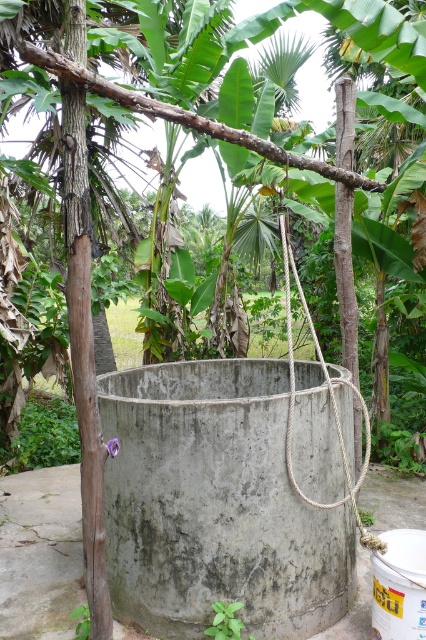
Can you confirm if gray concrete bucket at center is shorter than roperoughrope at center?

Correct, gray concrete bucket at center is not as tall as roperoughrope at center.

Between point (23, 504) and point (339, 428), which one is positioned behind?

The point (23, 504) is more distant.

The image size is (426, 640). I want to click on gray concrete bucket at center, so click(40, 552).